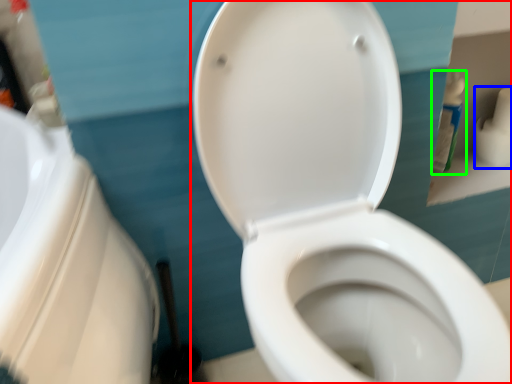
Question: Which object is the closest to the toilet (highlighted by a red box)? Choose among these: toilet paper (highlighted by a blue box) or cleaning product (highlighted by a green box).

Choices:
 (A) toilet paper
 (B) cleaning product

Answer: (B)